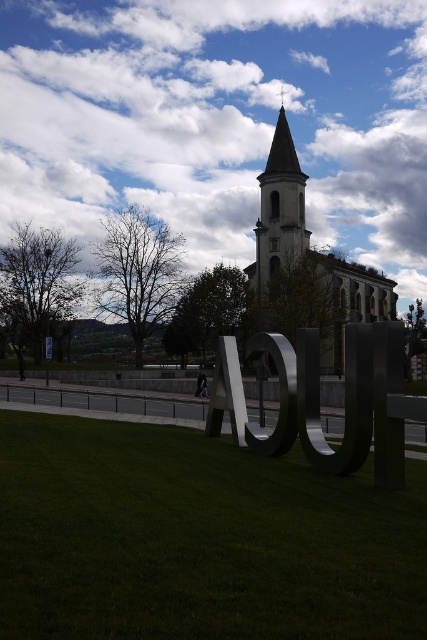
You are standing at the edge of the grassy area and want to take a photo of the white stone church at center. However, the green grass at lower center is blocking your view. Can you move closer to the church to get a clear shot without the grass in the frame?

The green grass at lower center is in front of the white stone church at center, so moving closer to the church would bring the grass even closer, keeping it in the frame. To avoid the grass, you should move further back to position yourself behind the grass where the church is visible beyond it.

You are standing at point A located at coordinates (280, 209) in the image. What structure can you see directly in front of you?

At point A located at coordinates (280, 209), you can see the white stone church at center directly in front of you.